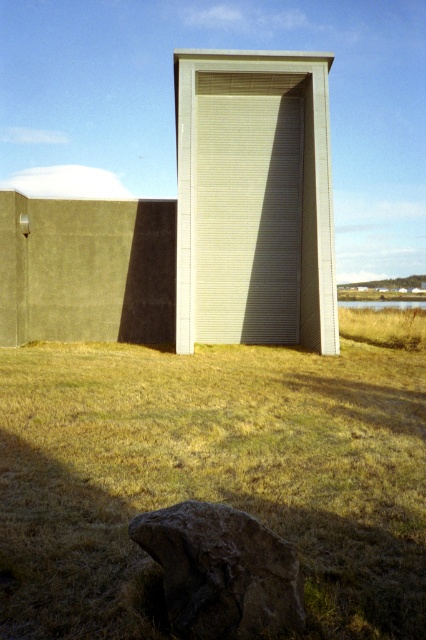
Question: Is beige textured door at center closer to the viewer compared to dark brown rough rock at lower center?

Choices:
 (A) no
 (B) yes

Answer: (A)

Question: Which point is farther to the camera?

Choices:
 (A) dry grass at center
 (B) dark brown rough rock at lower center
 (C) beige textured door at center

Answer: (C)

Question: Is dry grass at center to the right of beige textured door at center from the viewer's perspective?

Choices:
 (A) yes
 (B) no

Answer: (B)

Question: Which of the following is the closest to the observer?

Choices:
 (A) dry grass at center
 (B) beige textured door at center

Answer: (A)

Question: Considering the real-world distances, which object is farthest from the dry grass at center?

Choices:
 (A) dark brown rough rock at lower center
 (B) beige textured door at center

Answer: (B)

Question: Is beige textured door at center to the left of dark brown rough rock at lower center from the viewer's perspective?

Choices:
 (A) yes
 (B) no

Answer: (B)